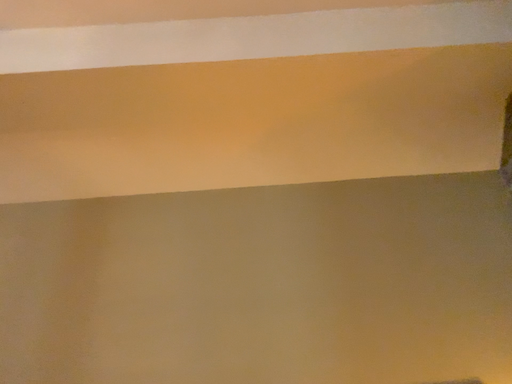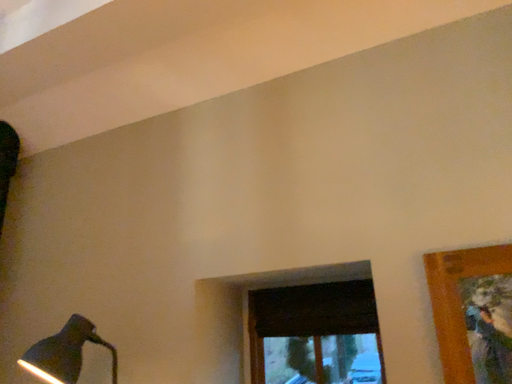
Question: Which way did the camera rotate in the video?

Choices:
 (A) rotated upward
 (B) rotated downward

Answer: (B)